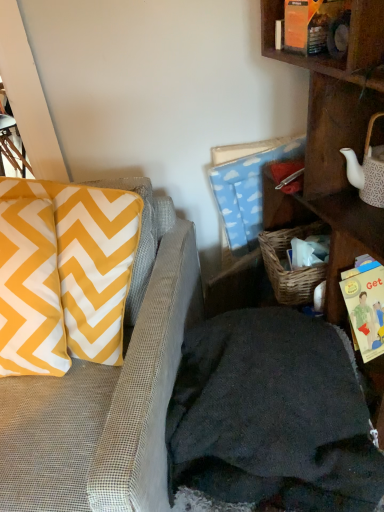
Question: From a real-world perspective, is yellow paper book at right positioned under textured gray couch at left based on gravity?

Choices:
 (A) yes
 (B) no

Answer: (B)

Question: Can you see yellow paper book at right touching textured gray couch at left?

Choices:
 (A) no
 (B) yes

Answer: (A)

Question: Considering the relative sizes of yellow paper book at right and textured gray couch at left in the image provided, is yellow paper book at right wider than textured gray couch at left?

Choices:
 (A) yes
 (B) no

Answer: (B)

Question: Is yellow paper book at right positioned beyond the bounds of textured gray couch at left?

Choices:
 (A) yes
 (B) no

Answer: (A)

Question: From the image's perspective, is yellow paper book at right below textured gray couch at left?

Choices:
 (A) yes
 (B) no

Answer: (B)

Question: Can you confirm if yellow paper book at right is shorter than textured gray couch at left?

Choices:
 (A) yes
 (B) no

Answer: (A)

Question: Considering the relative positions of yellow paper book at right and wooden shelf at right in the image provided, is yellow paper book at right to the right of wooden shelf at right from the viewer's perspective?

Choices:
 (A) no
 (B) yes

Answer: (A)

Question: Could wooden shelf at right be considered to be inside yellow paper book at right?

Choices:
 (A) yes
 (B) no

Answer: (B)

Question: Considering the relative sizes of yellow paper book at right and wooden shelf at right in the image provided, is yellow paper book at right smaller than wooden shelf at right?

Choices:
 (A) yes
 (B) no

Answer: (A)

Question: From a real-world perspective, does yellow paper book at right stand above wooden shelf at right?

Choices:
 (A) no
 (B) yes

Answer: (A)

Question: Does yellow paper book at right come in front of wooden shelf at right?

Choices:
 (A) no
 (B) yes

Answer: (A)

Question: Considering the relative positions of yellow paper book at right and wooden shelf at right in the image provided, is yellow paper book at right to the left of wooden shelf at right from the viewer's perspective?

Choices:
 (A) yes
 (B) no

Answer: (A)

Question: From a real-world perspective, does yellow/white chevron pillow at left sit lower than wooden shelf at right?

Choices:
 (A) no
 (B) yes

Answer: (A)